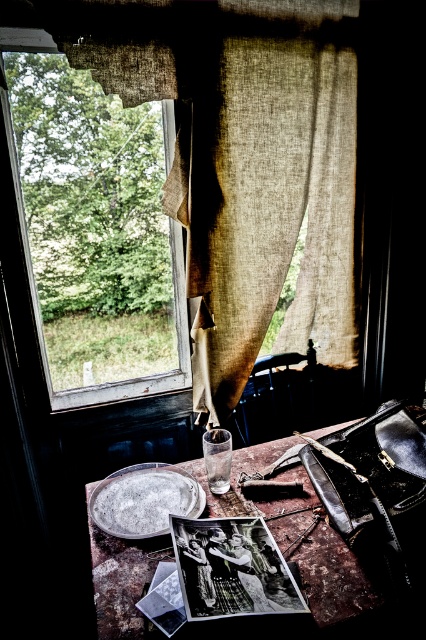
You are standing in the room and see two points marked on the wall. The first point is at coordinates point (204, 182) and the second is at point (83, 179). Which point is closer to you?

Point (204, 182) is in front of point (83, 179), so the first point is closer to you.

In the scene shown: You are a painter who needs to set up an easel in this room. The easel requires a clear space of at least 1 meter in front of it. Considering the burlap curtain at upper left and the rusty metal table at center, where should you place the easel to ensure there is enough space?

The burlap curtain at upper left is positioned over the rusty metal table at center, which means the table is directly below the curtain. To ensure a clear space of 1 meter in front, place the easel away from the area under the curtain and the table, perhaps near the wall opposite the window where there is more open space.

You are standing in the room and want to reach the burlap curtain at upper left. Given that you can stretch your arm 2.5 feet, can you touch it without moving your feet?

The burlap curtain at upper left is 4.49 feet away from viewer. Since your arm can only reach 2.5 feet, you cannot touch it without moving your feet.